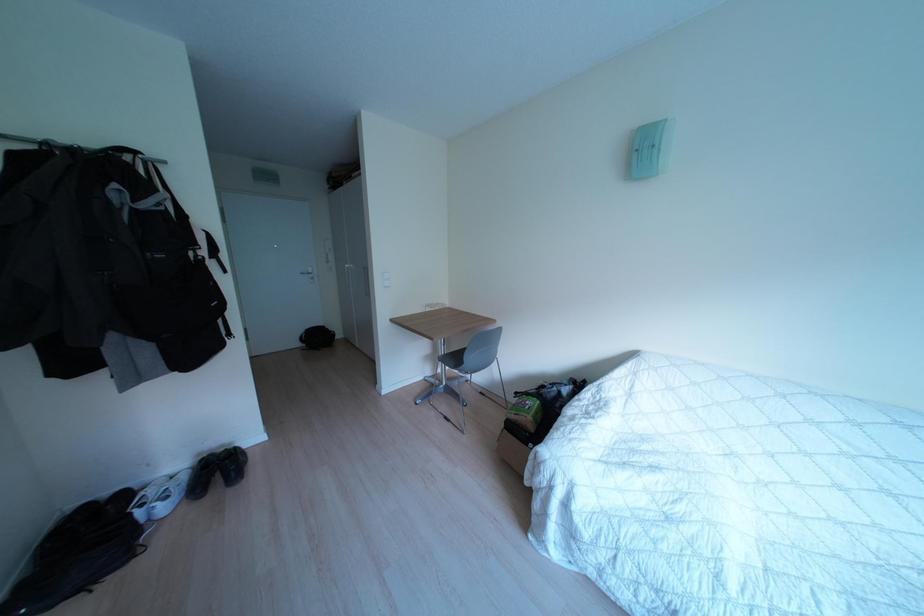
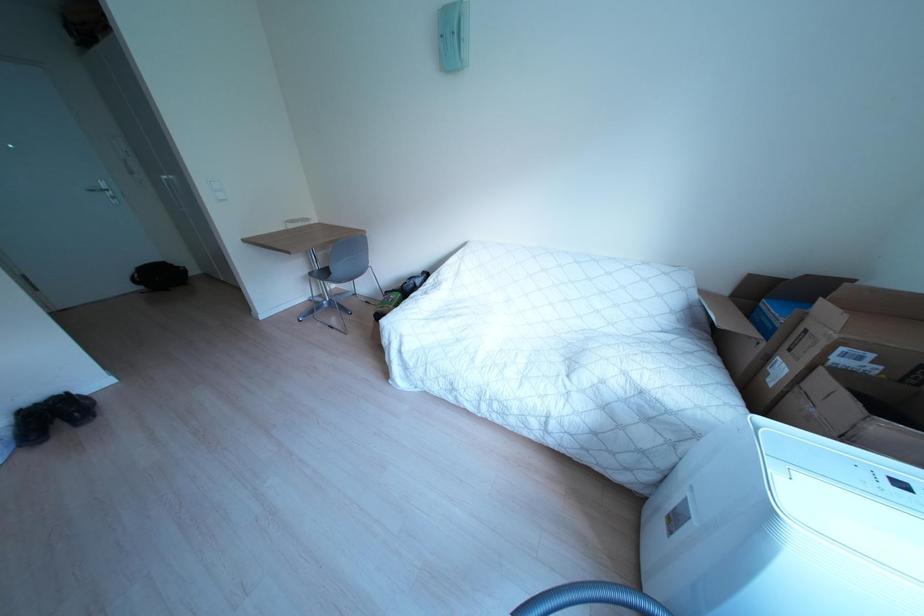
Based on the continuous images, in which direction is the camera rotating?

The camera rotated toward right-down.